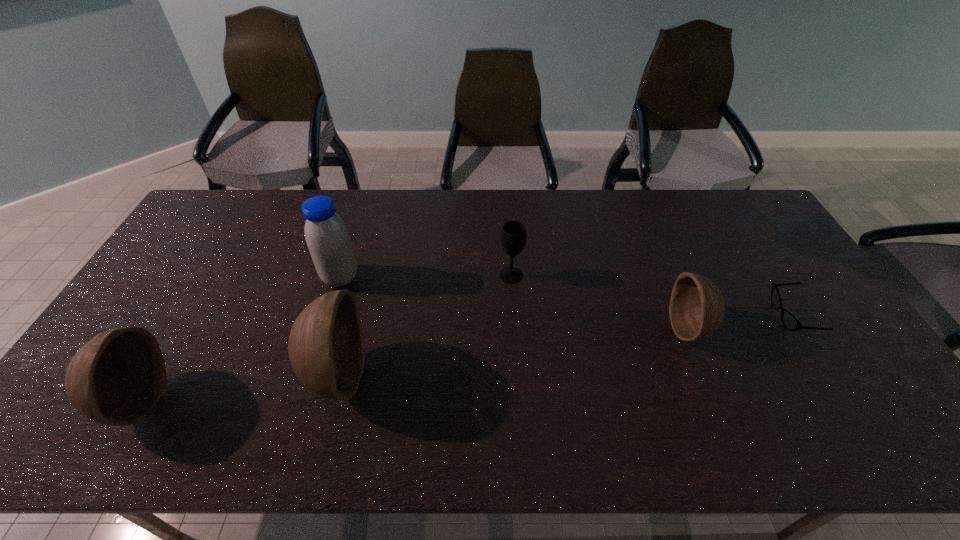
Where is `vacant region between the wineglass and the spectacles`? vacant region between the wineglass and the spectacles is located at coordinates (651, 295).

The image size is (960, 540). Identify the location of unoccupied area between the shortest object and the wineglass. (651, 295).

Identify the location of free spot between the leftmost bowl and the soya milk. This screenshot has width=960, height=540. (239, 339).

Locate which object is the fourth closest to the rightmost bowl. Please provide its 2D coordinates. Your answer should be formatted as a tuple, i.e. [(x, y)], where the tuple contains the x and y coordinates of a point satisfying the conditions above.

[(328, 240)]

You are a GUI agent. You are given a task and a screenshot of the screen. Output one action in this format:
    pyautogui.click(x=<x>, y=<y>)
    Task: Click on the fourth closest object relative to the fourth object from left to right
    
    Given the screenshot: What is the action you would take?
    pyautogui.click(x=790, y=322)

Locate which bowl ranks second in proximity to the wineglass. Please provide its 2D coordinates. Your answer should be formatted as a tuple, i.e. [(x, y)], where the tuple contains the x and y coordinates of a point satisfying the conditions above.

[(697, 308)]

Find the location of a particular element. The height and width of the screenshot is (540, 960). bowl object that ranks as the closest to the leftmost object is located at coordinates (326, 347).

Identify the location of free space that satisfies the following two spatial constraints: 1. on the front side of the second bowl from left to right; 2. on the left side of the soya milk. The height and width of the screenshot is (540, 960). (311, 374).

The height and width of the screenshot is (540, 960). What are the coordinates of `free space in the image that satisfies the following two spatial constraints: 1. on the back side of the soya milk; 2. on the right side of the fourth object from left to right` in the screenshot? It's located at (341, 275).

The image size is (960, 540). Find the location of `free location that satisfies the following two spatial constraints: 1. on the back side of the wineglass; 2. on the right side of the second bowl from right to left`. free location that satisfies the following two spatial constraints: 1. on the back side of the wineglass; 2. on the right side of the second bowl from right to left is located at coordinates point(363,275).